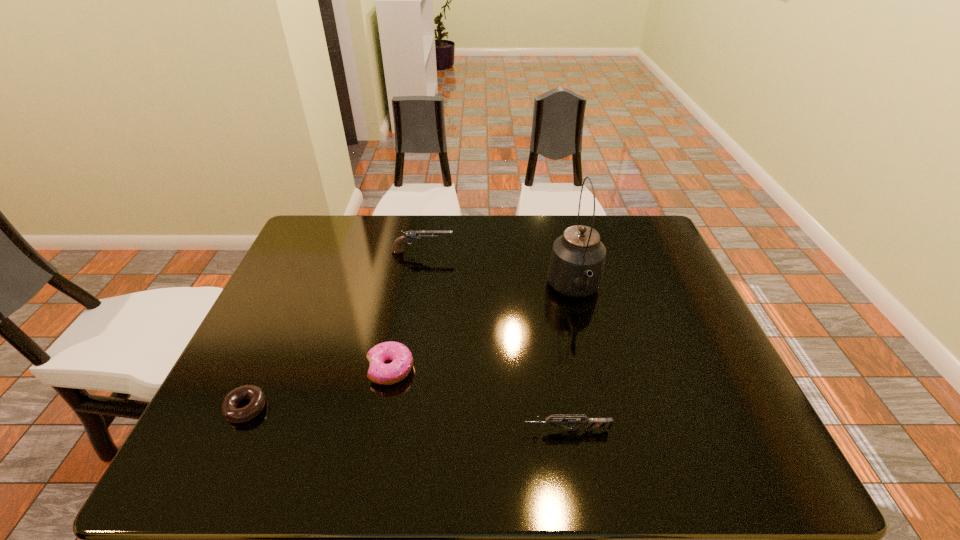
Where is `vacant space located 0.150m spout on the tallest object`? The height and width of the screenshot is (540, 960). vacant space located 0.150m spout on the tallest object is located at coordinates (592, 365).

This screenshot has height=540, width=960. What are the coordinates of `vacant area situated aiming along the barrel of the farther gun` in the screenshot? It's located at (528, 252).

Identify the location of free space located 0.090m aimed along the barrel of the right gun. The height and width of the screenshot is (540, 960). (480, 430).

This screenshot has height=540, width=960. In order to click on blank area located aimed along the barrel of the right gun in this screenshot , I will do `click(494, 430)`.

This screenshot has width=960, height=540. Find the location of `vacant space located aimed along the barrel of the right gun`. vacant space located aimed along the barrel of the right gun is located at coordinates (398, 430).

Find the location of a particular element. The height and width of the screenshot is (540, 960). free region located on the back of the farther doughnut is located at coordinates (400, 314).

Locate an element on the screen. Image resolution: width=960 pixels, height=540 pixels. free space located on the back of the nearer doughnut is located at coordinates (292, 306).

This screenshot has height=540, width=960. Identify the location of object that is positioned at the far edge. (408, 236).

Find the location of a particular element. The height and width of the screenshot is (540, 960). object that is at the left edge is located at coordinates (230, 411).

This screenshot has width=960, height=540. Find the location of `free space at the far edge`. free space at the far edge is located at coordinates (516, 238).